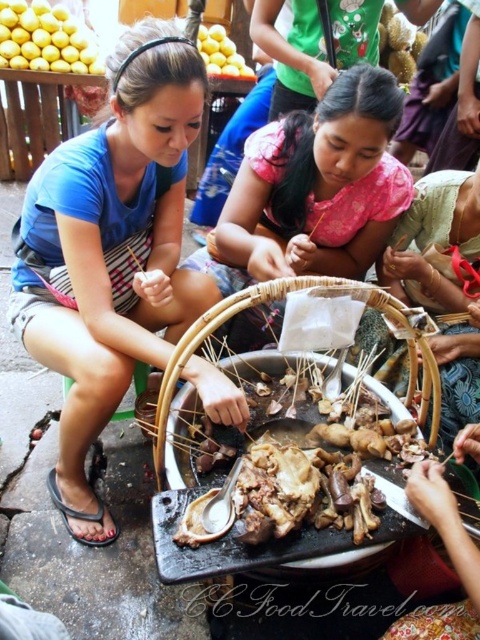
In the scene shown: Who is positioned more to the right, brown matte bone at center or woven bamboo basket at center?

Positioned to the right is woven bamboo basket at center.

Can you confirm if brown matte bone at center is wider than woven bamboo basket at center?

In fact, brown matte bone at center might be narrower than woven bamboo basket at center.

The height and width of the screenshot is (640, 480). Identify the location of brown matte bone at center. click(313, 451).

This screenshot has height=640, width=480. Identify the location of brown matte bone at center. (313, 451).

Is brown matte bone at center bigger than yellow matte lemons at upper left?

Indeed, brown matte bone at center has a larger size compared to yellow matte lemons at upper left.

Does brown matte bone at center appear on the right side of yellow matte lemons at upper left?

Indeed, brown matte bone at center is positioned on the right side of yellow matte lemons at upper left.

Which is in front, point (287, 474) or point (8, 1)?

Point (287, 474)

Where is `brown matte bone at center`? The image size is (480, 640). brown matte bone at center is located at coordinates (313, 451).

Which is more to the left, green fabric headscarf at center or yellow matte lemons at upper center?

yellow matte lemons at upper center is more to the left.

Is green fabric headscarf at center positioned at the back of yellow matte lemons at upper center?

No, it is in front of yellow matte lemons at upper center.

Is point (440, 234) in front of point (216, 51)?

Yes, point (440, 234) is closer to viewer.

Where is `green fabric headscarf at center`? This screenshot has height=640, width=480. green fabric headscarf at center is located at coordinates point(436,243).